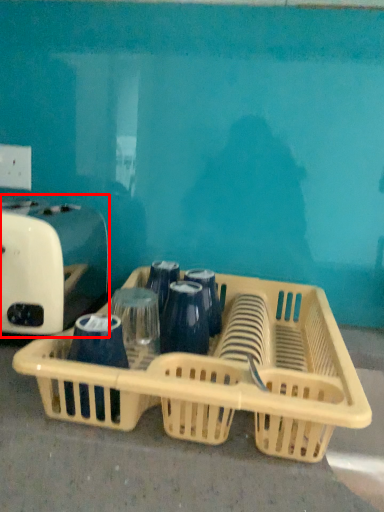
Question: From the image's perspective, where is toaster (annotated by the red box) located relative to basket?

Choices:
 (A) below
 (B) above

Answer: (B)